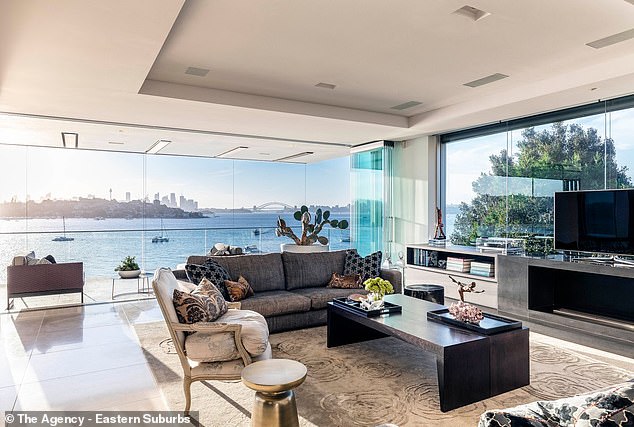
I want to click on geometric tan rug, so click(x=401, y=388).